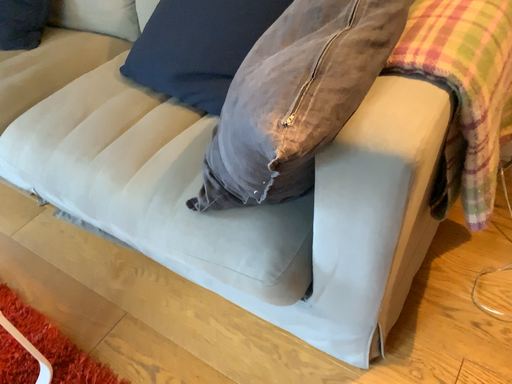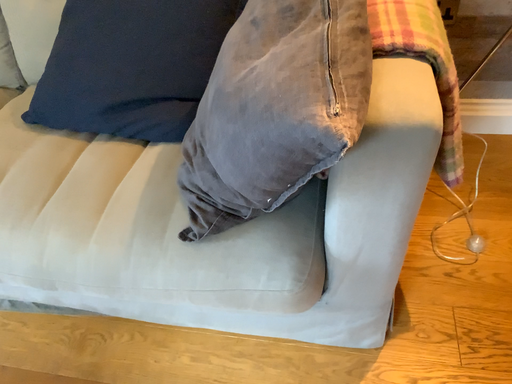
Question: Which way did the camera rotate in the video?

Choices:
 (A) rotated right
 (B) rotated left

Answer: (A)